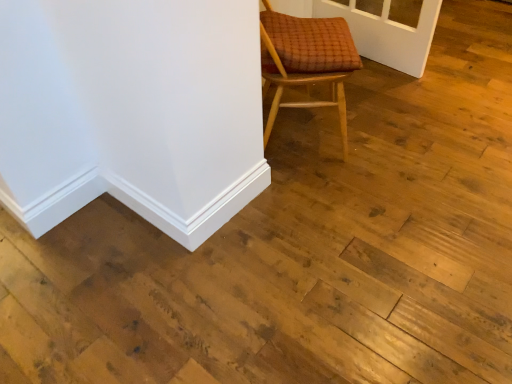
I want to click on free point to the right of brown woven cushioned chair at upper right, so click(x=387, y=132).